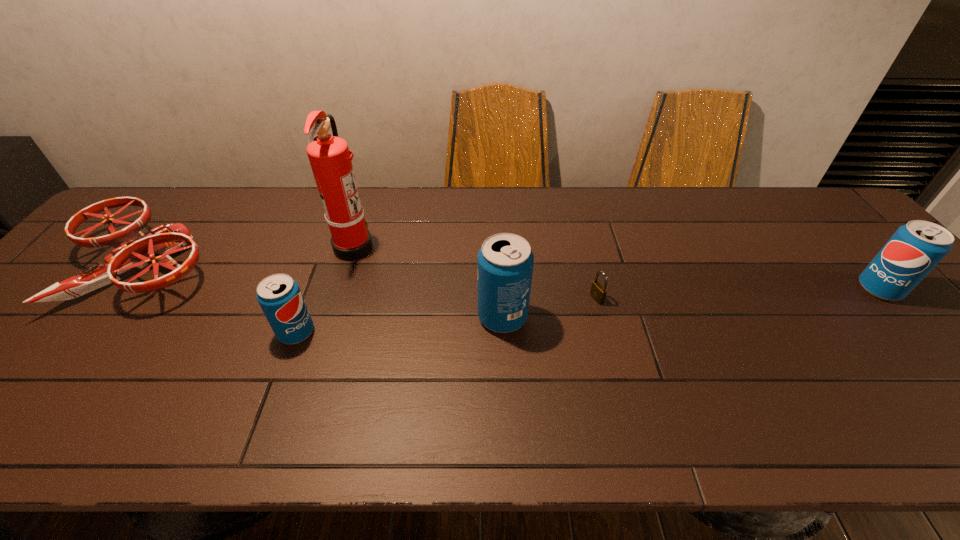
Please point a space for a new pop_(soda) to maintain equal intervals. Please provide its 2D coordinates. Your answer should be formatted as a tuple, i.e. [(x, y)], where the tuple contains the x and y coordinates of a point satisfying the conditions above.

[(697, 302)]